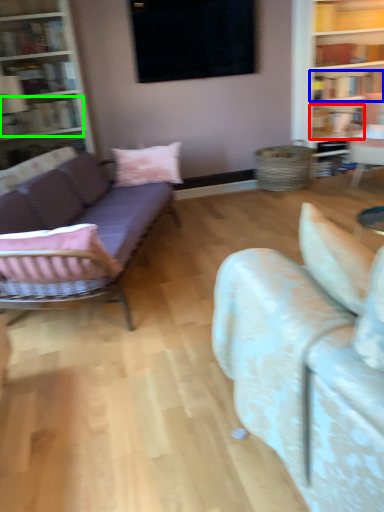
Question: Which is farther away from book (highlighted by a red box)? book (highlighted by a blue box) or book (highlighted by a green box)?

Choices:
 (A) book
 (B) book

Answer: (B)